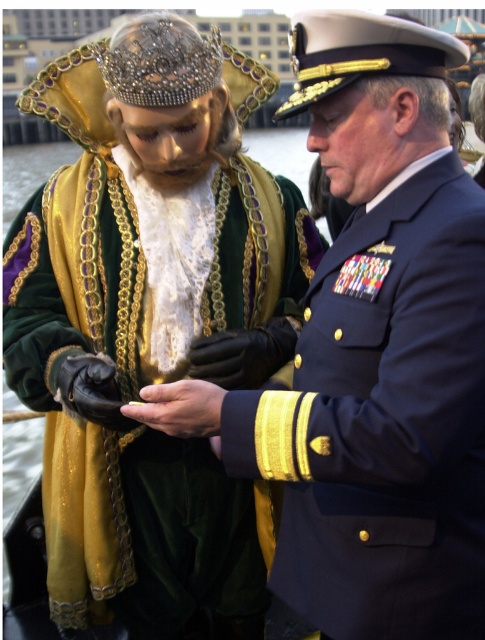
You are a tailor measuring a shiny blue uniform at center and a matte black hand at center for a custom accessory. Which object has a greater width that you need to consider?

The shiny blue uniform at center has a greater width than the matte black hand at center, so you should consider the width of the shiny blue uniform at center.

You are a photographer taking a picture of the two individuals in the scene. You want to focus on the point that is closer to the camera. Which point should you choose between point (346, 595) and point (143, 388)?

Point (143, 388) is closer to the camera than point (346, 595), so you should focus on point (143, 388).